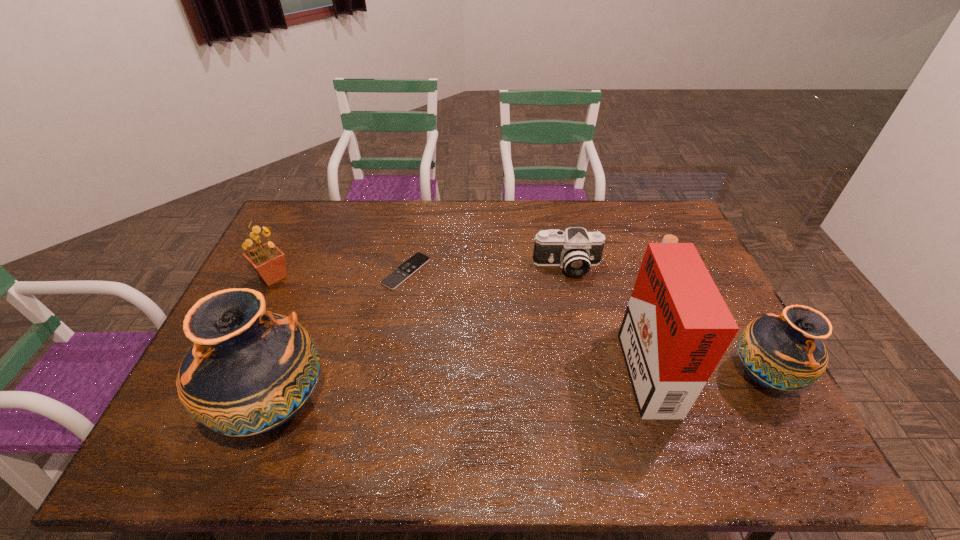
If the aim is uniform spacing by inserting an additional pottery among them, please point to a vacant space for this new pottery. Please provide its 2D coordinates. Your answer should be formatted as a tuple, i.e. [(x, y)], where the tuple contains the x and y coordinates of a point satisfying the conditions above.

[(526, 391)]